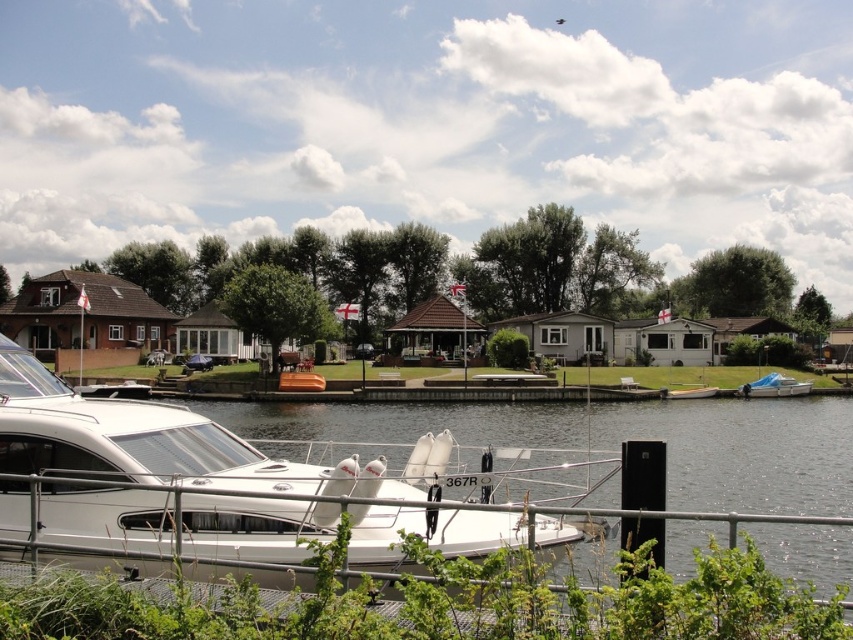
Question: Based on their relative distances, which object is nearer to the white plastic boat at lower right?

Choices:
 (A) brown wooden boat at center
 (B) white glossy boat at center

Answer: (A)

Question: Is white glossy boat at center bigger than white fiberglass dinghy at center?

Choices:
 (A) no
 (B) yes

Answer: (B)

Question: Can you confirm if white plastic boat at lower right is positioned below white fiberglass dinghy at center?

Choices:
 (A) no
 (B) yes

Answer: (A)

Question: Can you confirm if white glossy boat at center is bigger than brown wooden boat at center?

Choices:
 (A) no
 (B) yes

Answer: (B)

Question: Which object appears farthest from the camera in this image?

Choices:
 (A) white fiberglass dinghy at center
 (B) white plastic boat at lower right

Answer: (B)

Question: Which of the following is the farthest from the observer?

Choices:
 (A) (285, 384)
 (B) (688, 396)
 (C) (131, 403)

Answer: (B)